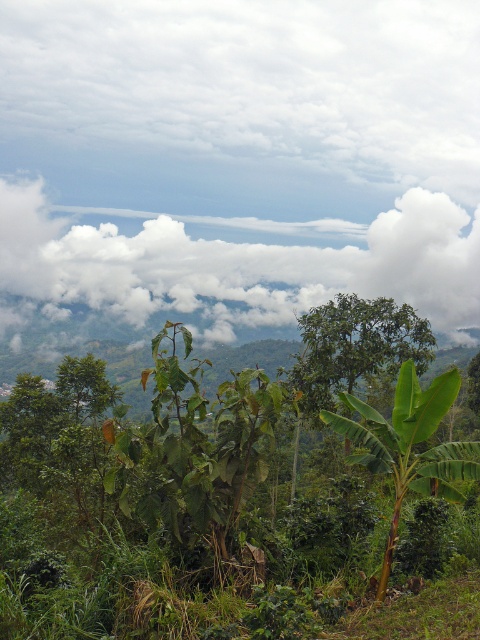
Based on the photo, please look at the image and locate the point at coordinates [229,266]. What object is located at that point?

The point at coordinates [229,266] indicates a white fluffy cloud at upper center.

You are standing in the middle of the lush landscape and want to take a photo of the green leafy plant at center without the white fluffy cloud at upper center blocking the view. How should you adjust your position?

Move your position so that the green leafy plant at center is between you and the white fluffy cloud at upper center. Since the white fluffy cloud at upper center is further away, positioning the plant in front of it will block the cloud from the view.